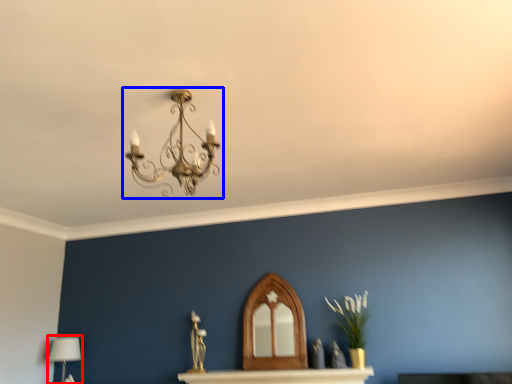
Question: Which object appears closest to the camera in this image, table lamp (highlighted by a red box) or lamp (highlighted by a blue box)?

Choices:
 (A) table lamp
 (B) lamp

Answer: (B)